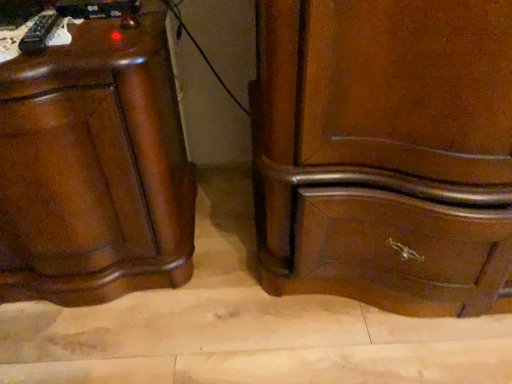
Where is `free location to the right of shiny brown wood chest of drawers at left`? free location to the right of shiny brown wood chest of drawers at left is located at coordinates (252, 276).